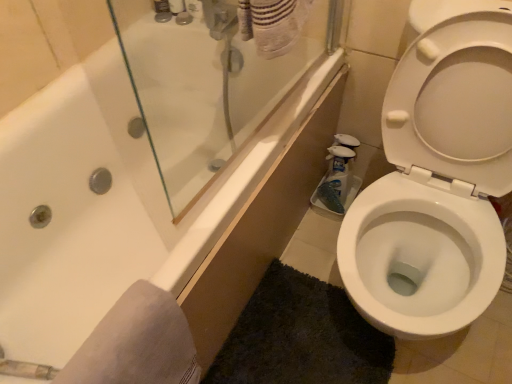
Question: Considering the relative sizes of dark gray shaggy bath mat at lower right and white glossy toilet at right in the image provided, is dark gray shaggy bath mat at lower right bigger than white glossy toilet at right?

Choices:
 (A) yes
 (B) no

Answer: (B)

Question: Is the position of dark gray shaggy bath mat at lower right more distant than that of white glossy toilet at right?

Choices:
 (A) no
 (B) yes

Answer: (B)

Question: Is dark gray shaggy bath mat at lower right not near white glossy toilet at right?

Choices:
 (A) no
 (B) yes

Answer: (A)

Question: From a real-world perspective, does dark gray shaggy bath mat at lower right sit lower than white glossy toilet at right?

Choices:
 (A) no
 (B) yes

Answer: (B)

Question: Is dark gray shaggy bath mat at lower right to the right of white glossy toilet at right from the viewer's perspective?

Choices:
 (A) no
 (B) yes

Answer: (A)

Question: Considering the positions of white glossy toilet at right and dark gray shaggy bath mat at lower right in the image, is white glossy toilet at right taller or shorter than dark gray shaggy bath mat at lower right?

Choices:
 (A) short
 (B) tall

Answer: (B)

Question: Is white glossy toilet at right bigger or smaller than dark gray shaggy bath mat at lower right?

Choices:
 (A) big
 (B) small

Answer: (A)

Question: Considering the positions of point (402, 160) and point (325, 319), is point (402, 160) closer or farther from the camera than point (325, 319)?

Choices:
 (A) farther
 (B) closer

Answer: (B)

Question: From a real-world perspective, is white glossy toilet at right above or below dark gray shaggy bath mat at lower right?

Choices:
 (A) above
 (B) below

Answer: (A)

Question: From a real-world perspective, relative to white plastic soap dispenser at upper center, acting as the second toiletry starting from the left, is white plastic bottle at upper center, which ranks as the third toiletry in left-to-right order, vertically above or below?

Choices:
 (A) below
 (B) above

Answer: (B)

Question: Do you think white plastic bottle at upper center, which ranks as the third toiletry in left-to-right order, is within white plastic soap dispenser at upper center, the 2th toiletry positioned from the right, or outside of it?

Choices:
 (A) inside
 (B) outside

Answer: (B)

Question: In the image, is white plastic bottle at upper center, which appears as the first toiletry when viewed from the right, positioned in front of or behind white plastic soap dispenser at upper center, acting as the second toiletry starting from the left?

Choices:
 (A) behind
 (B) front

Answer: (B)

Question: From their relative heights in the image, would you say white plastic bottle at upper center, which appears as the first toiletry when viewed from the right, is taller or shorter than white plastic soap dispenser at upper center, the 2th toiletry positioned from the right?

Choices:
 (A) short
 (B) tall

Answer: (B)

Question: Considering the positions of point coord(305,382) and point coord(194,11), is point coord(305,382) closer or farther from the camera than point coord(194,11)?

Choices:
 (A) farther
 (B) closer

Answer: (B)

Question: Visually, is dark gray shaggy bath mat at lower right positioned to the left or to the right of white plastic bottle at upper center, which ranks as the third toiletry in left-to-right order?

Choices:
 (A) right
 (B) left

Answer: (A)